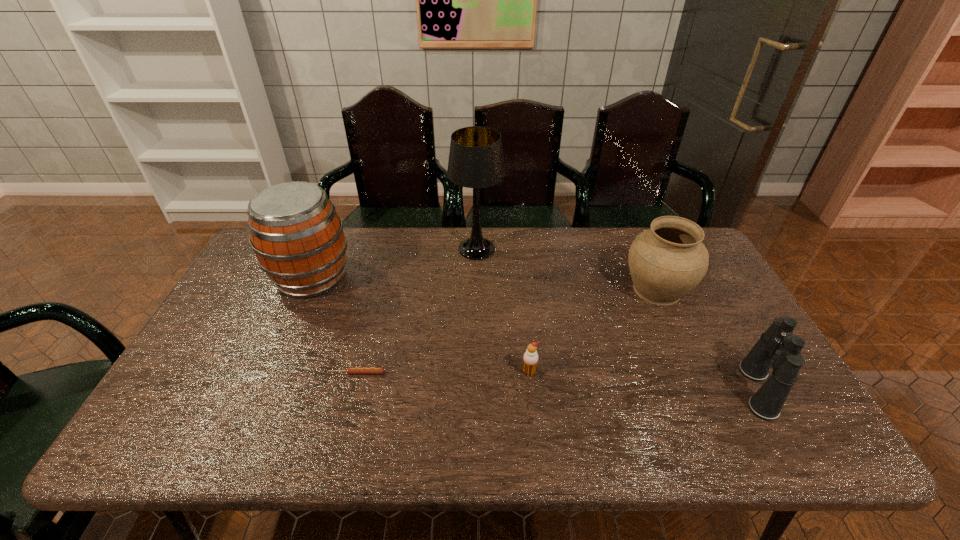
Image resolution: width=960 pixels, height=540 pixels. Find the location of `free spot located 0.320m on the right of the third object from left to right`. free spot located 0.320m on the right of the third object from left to right is located at coordinates (596, 249).

Image resolution: width=960 pixels, height=540 pixels. Find the location of `vacant space located on the right of the cider`. vacant space located on the right of the cider is located at coordinates (425, 277).

At what (x,y) coordinates should I click in order to perform the action: click on vacant space positioned on the left of the urn. Please return your answer as a coordinate pair (x, y). This screenshot has height=540, width=960. Looking at the image, I should click on (534, 289).

Find the location of a particular element. free space located on the back of the binoculars is located at coordinates (687, 264).

I want to click on free space located at the front with a straw on the icecream, so click(x=537, y=442).

You are a GUI agent. You are given a task and a screenshot of the screen. Output one action in this format:
    pyautogui.click(x=<x>, y=<y>)
    Task: Click on the free space located 0.120m on the back of the sausage
    
    Given the screenshot: What is the action you would take?
    pyautogui.click(x=367, y=335)

This screenshot has width=960, height=540. I want to click on table lamp that is at the far edge, so click(476, 161).

Where is `cider at the far edge`? This screenshot has height=540, width=960. cider at the far edge is located at coordinates (297, 236).

You are a GUI agent. You are given a task and a screenshot of the screen. Output one action in this format:
    pyautogui.click(x=<x>, y=<y>)
    Task: Click on the urn positioned at the far edge
    
    Given the screenshot: What is the action you would take?
    pyautogui.click(x=667, y=261)

Locate an element on the screen. This screenshot has height=540, width=960. object that is at the near edge is located at coordinates (777, 348).